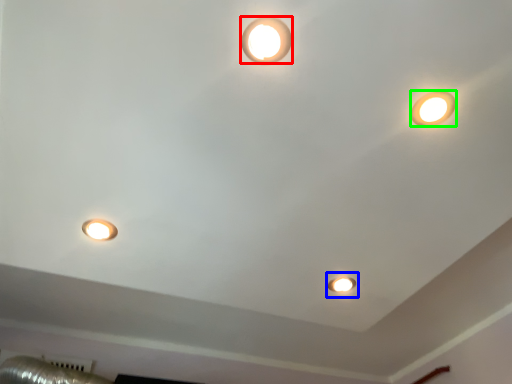
Question: Which object is the farthest from lamp (highlighted by a red box)? Choose among these: stage light (highlighted by a blue box) or lamp (highlighted by a green box).

Choices:
 (A) stage light
 (B) lamp

Answer: (A)